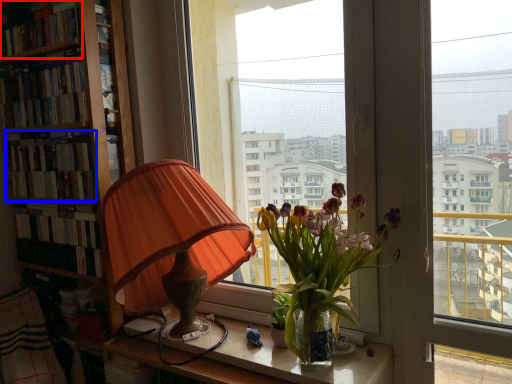
Question: Which object is further to the camera taking this photo, book (highlighted by a red box) or book (highlighted by a blue box)?

Choices:
 (A) book
 (B) book

Answer: (B)